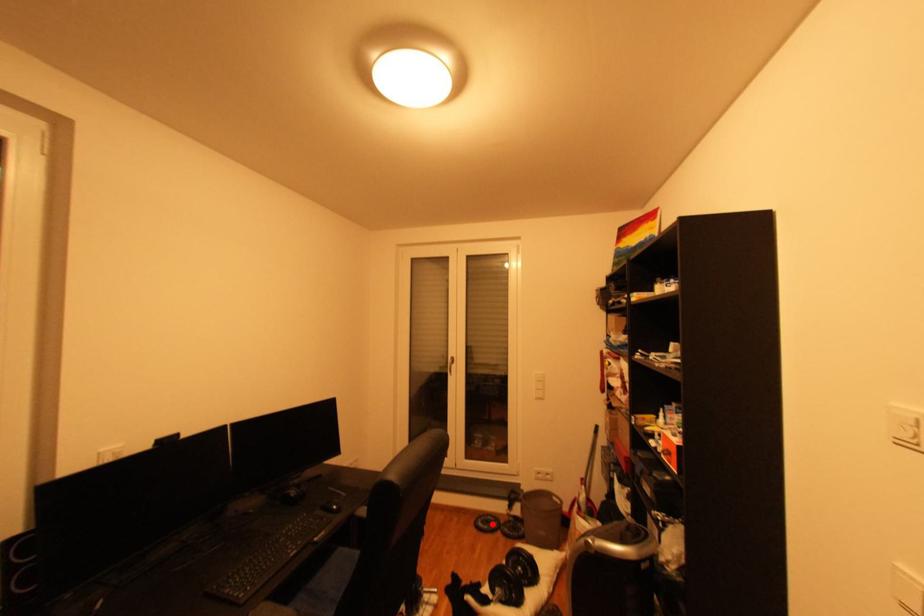
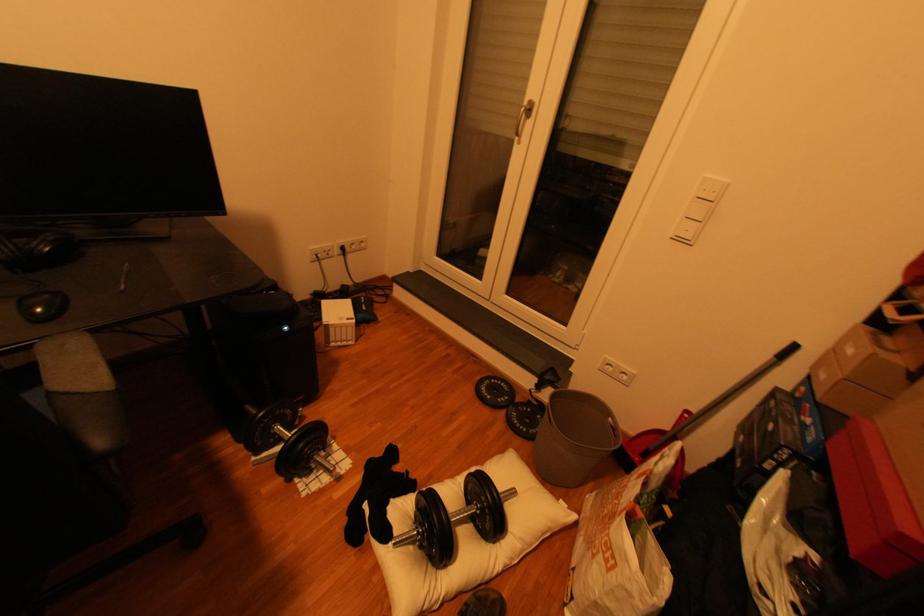
Question: I am providing you with two images of the same scene from different viewpoints. Image1 has a red point marked. In image2, the corresponding 3D location appears at what relative position? Reply with the corresponding letter.

Choices:
 (A) Closer
 (B) Farther

Answer: (A)